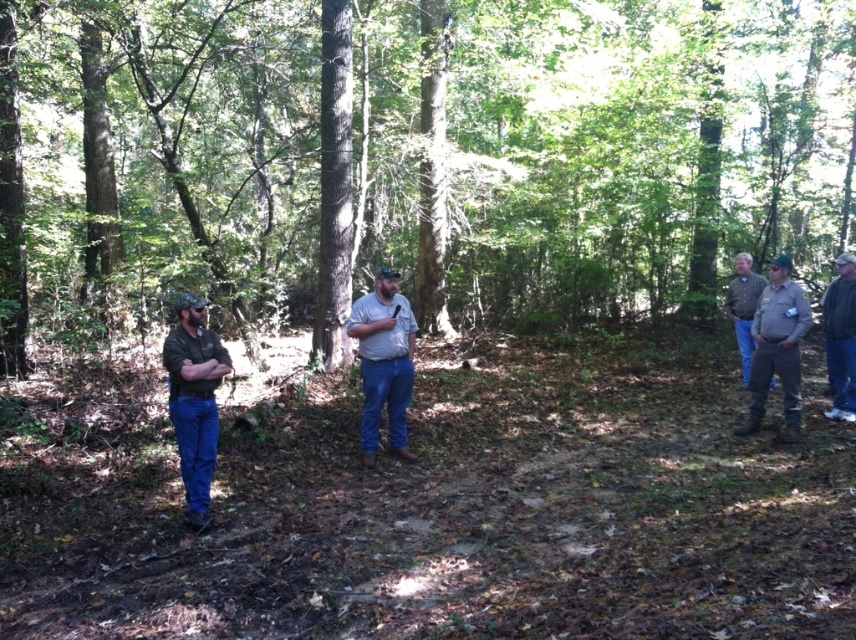
Does point (827, 307) lie in front of point (732, 310)?

Yes, it is.

Find the location of a particular element. This screenshot has height=640, width=856. blue denim jeans at lower right is located at coordinates (841, 337).

I want to click on blue denim jeans at lower right, so click(x=841, y=337).

Is green denim pants at left closer to camera compared to denim jeans at center?

Yes.

Where is `green denim pants at left`? The image size is (856, 640). green denim pants at left is located at coordinates (194, 401).

Where is `green denim pants at left`? The image size is (856, 640). green denim pants at left is located at coordinates (194, 401).

Can you confirm if brown uniform at right is positioned to the left of brown leather jacket at right?

Indeed, brown uniform at right is positioned on the left side of brown leather jacket at right.

Does point (776, 362) come closer to viewer compared to point (740, 260)?

Yes, it is in front of point (740, 260).

The width and height of the screenshot is (856, 640). I want to click on brown uniform at right, so click(x=777, y=348).